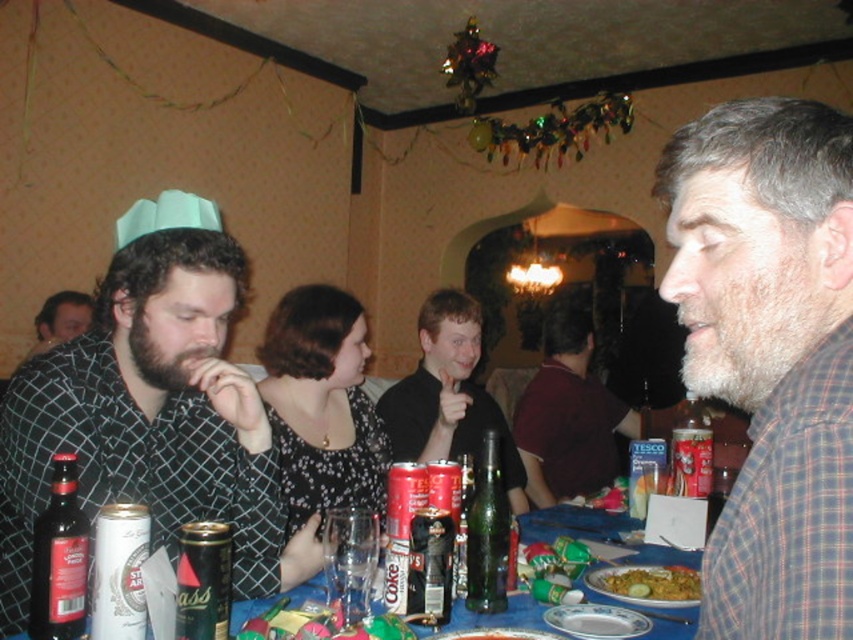
Does metallic can at table center appear on the right side of dark gray checkered shirt at left?

Correct, you'll find metallic can at table center to the right of dark gray checkered shirt at left.

Between metallic can at table center and dark gray checkered shirt at left, which one has less height?

With less height is metallic can at table center.

Between point (424, 616) and point (38, 333), which one is positioned behind?

The point (38, 333) is behind.

Locate an element on the screen. The image size is (853, 640). metallic can at table center is located at coordinates pyautogui.click(x=428, y=566).

Based on the photo, which is more to the right, glassy plastic bottle at center or dark brown glass bottle at lower left?

glassy plastic bottle at center is more to the right.

Describe the element at coordinates (601, 532) in the screenshot. Image resolution: width=853 pixels, height=640 pixels. I see `glassy plastic bottle at center` at that location.

Between point (604, 563) and point (85, 557), which one is positioned behind?

Positioned behind is point (604, 563).

Find the location of a particular element. glassy plastic bottle at center is located at coordinates (601, 532).

This screenshot has height=640, width=853. Describe the element at coordinates (152, 410) in the screenshot. I see `matte black shirt at left` at that location.

This screenshot has width=853, height=640. In order to click on matte black shirt at left in this screenshot , I will do `click(152, 410)`.